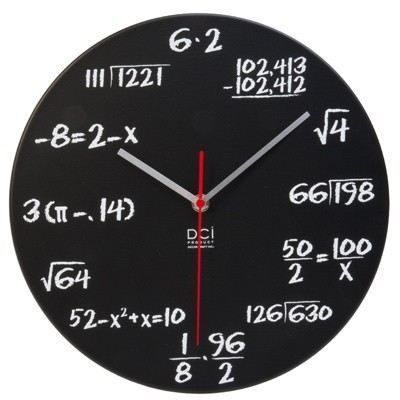
At what (x,y) coordinates should I click in order to perform the action: click on clock. Please return your answer as a coordinate pair (x, y). This screenshot has width=400, height=400. Looking at the image, I should click on (149, 44).